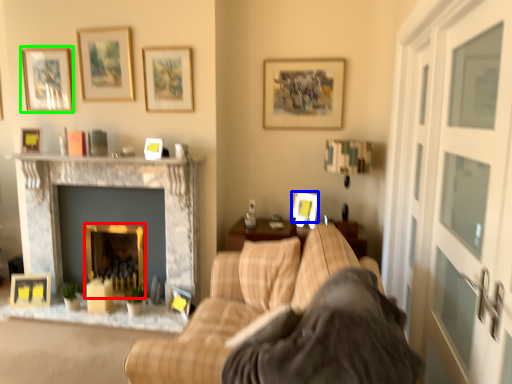
Question: Estimate the real-world distances between objects in this image. Which object is closer to fireplace (highlighted by a red box), picture frame (highlighted by a blue box) or picture frame (highlighted by a green box)?

Choices:
 (A) picture frame
 (B) picture frame

Answer: (B)